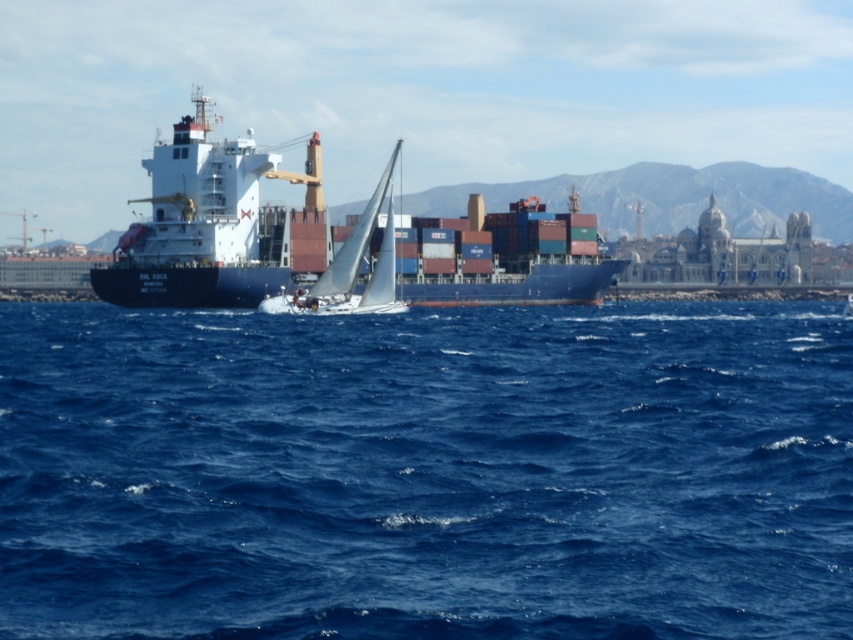
Which is more to the left, blue water at center or blue matte cargo ship at center?

blue water at center

In the scene shown: Is blue water at center further to camera compared to blue matte cargo ship at center?

No, blue water at center is closer to the viewer.

Which is in front, point (425, 609) or point (177, 273)?

Point (425, 609) is in front.

You are a GUI agent. You are given a task and a screenshot of the screen. Output one action in this format:
    pyautogui.click(x=<x>, y=<y>)
    Task: Click on the blue water at center
    
    Given the screenshot: What is the action you would take?
    pyautogui.click(x=426, y=472)

Does blue water at center have a greater width compared to white sailboat at center?

Correct, the width of blue water at center exceeds that of white sailboat at center.

Can you confirm if blue water at center is shorter than white sailboat at center?

Yes.

Is point (51, 490) positioned before point (376, 186)?

Yes.

Where is `blue water at center`? blue water at center is located at coordinates (426, 472).

Is point (328, 268) in front of point (314, 282)?

That is True.

Which is more to the left, blue matte cargo ship at center or white sailboat at center?

white sailboat at center is more to the left.

Where is `blue matte cargo ship at center`? The image size is (853, 640). blue matte cargo ship at center is located at coordinates (227, 228).

The image size is (853, 640). I want to click on blue matte cargo ship at center, so click(x=227, y=228).